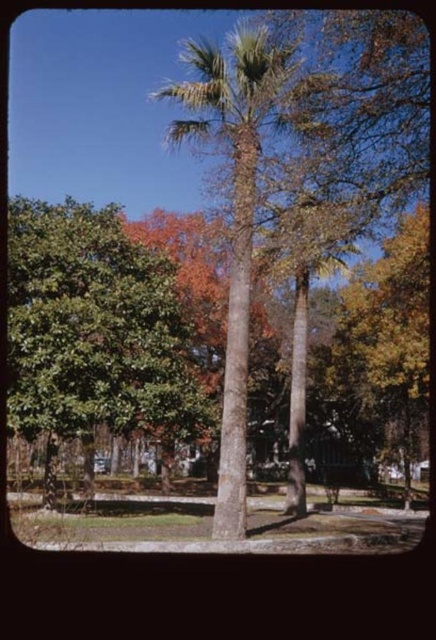
You are planning to plant a new tree in the garden between the green leafy tree at left and the smooth brown palm tree at center. The new tree requires at least 5 meters of space between it and any existing trees. Based on the current spacing between the existing trees, is this feasible?

The green leafy tree at left and smooth brown palm tree at center are currently 4.63 meters apart. Since the new tree requires at least 5 meters of space between it and any existing trees, the existing trees are too close to accommodate the new tree without violating the spacing requirement.